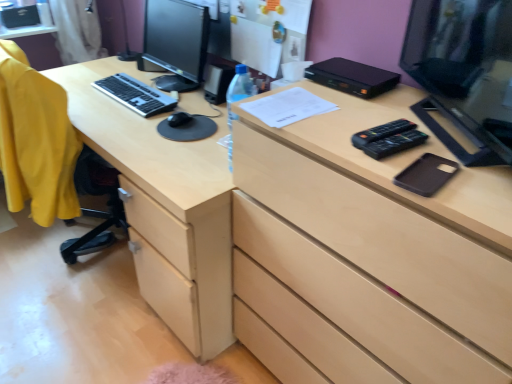
Locate an element on the screen. The width and height of the screenshot is (512, 384). free space in front of black plastic printer at upper center is located at coordinates (367, 103).